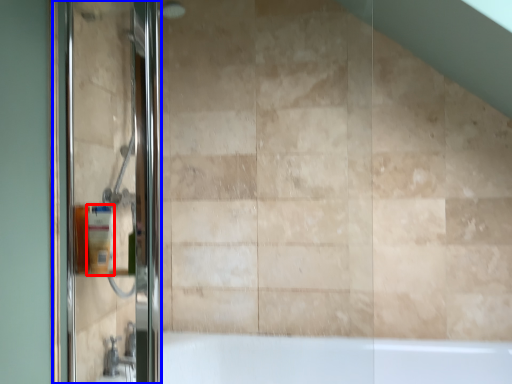
Question: Which of the following is the closest to the observer, toiletry (highlighted by a red box) or screen door (highlighted by a blue box)?

Choices:
 (A) toiletry
 (B) screen door

Answer: (B)